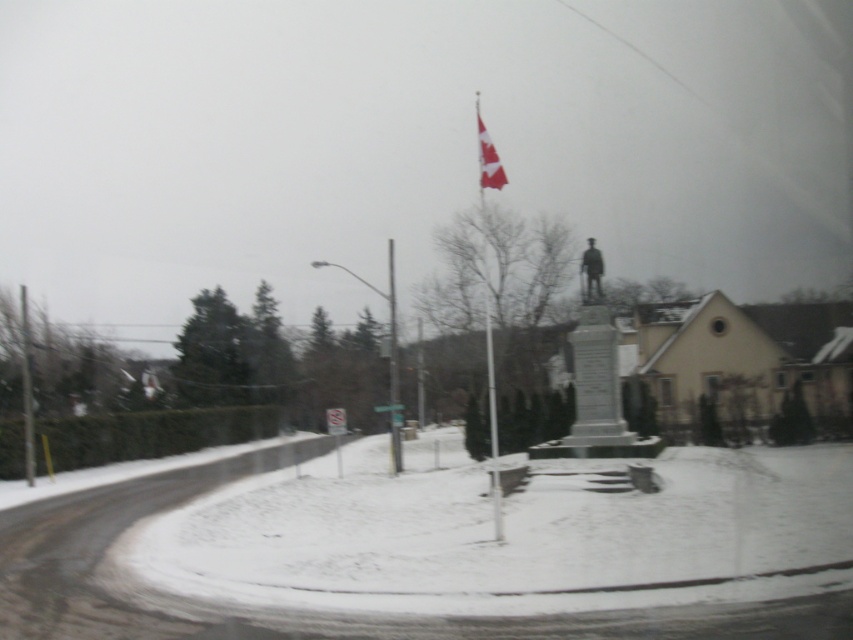
Question: Estimate the real-world distances between objects in this image. Which object is closer to the red and white fabric flag at upper center?

Choices:
 (A) white metallic flag pole at center
 (B) white plastic sign at center
 (C) metallic pole at center
 (D) metallic pole at left

Answer: (A)

Question: Among these points, which one is farthest from the camera?

Choices:
 (A) tap(479, 116)
 (B) tap(402, 406)

Answer: (A)

Question: Can you confirm if red and white fabric flag at upper center is positioned to the left of white plastic sign at center?

Choices:
 (A) no
 (B) yes

Answer: (A)

Question: Among these points, which one is farthest from the camera?

Choices:
 (A) (30, 440)
 (B) (483, 154)
 (C) (384, 408)

Answer: (B)

Question: Does red and white fabric flag at upper center have a smaller size compared to white plastic sign at center?

Choices:
 (A) yes
 (B) no

Answer: (B)

Question: Does metallic pole at left come behind red and white fabric flag at upper center?

Choices:
 (A) yes
 (B) no

Answer: (A)